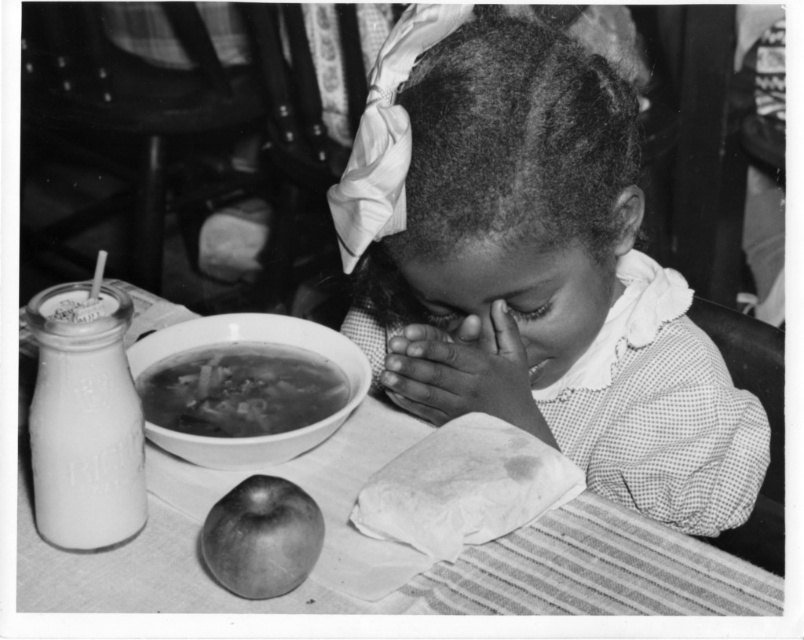
You are a photographer analyzing this black and white photo. You notice the smooth skin hands at center and the shiny silver apple at lower left. Based on their positions, which object is closer to the right edge of the frame?

The smooth skin hands at center is positioned on the right side of the shiny silver apple at lower left, meaning the smooth skin hands at center is closer to the right edge of the frame.

Based on the scene description, which object is taller between the smooth fabric headscarf at upper center and the white ceramic bowl at upper center?

The smooth fabric headscarf at upper center is taller than the white ceramic bowl at upper center according to the description.